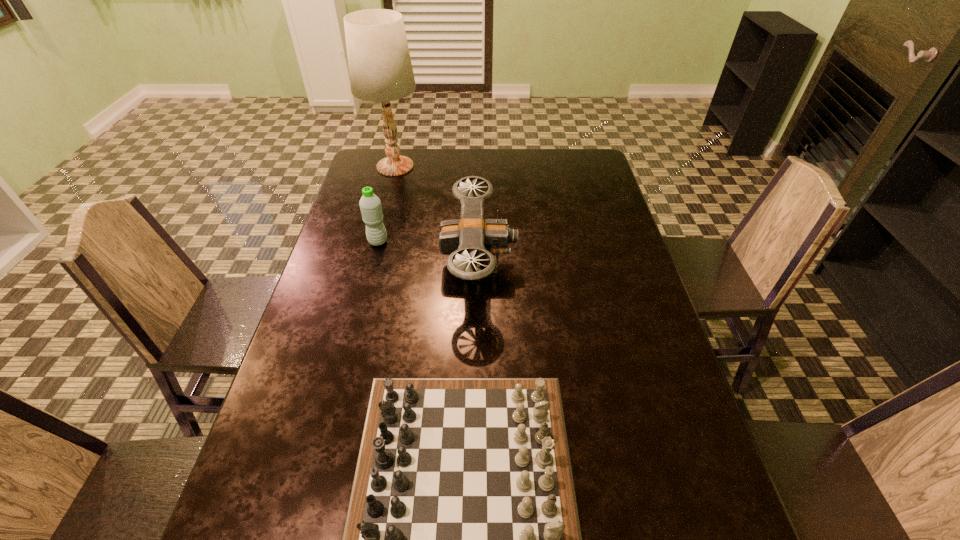
Where is `vacant area that lies between the drone and the water bottle`? This screenshot has width=960, height=540. vacant area that lies between the drone and the water bottle is located at coordinates (428, 252).

Where is `the second closest object relative to the water bottle`? the second closest object relative to the water bottle is located at coordinates (380, 69).

The width and height of the screenshot is (960, 540). I want to click on the closest object to the water bottle, so click(471, 235).